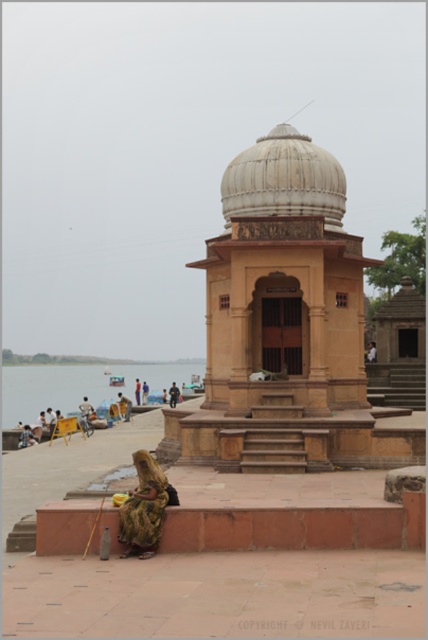
Question: Which object is farther from the camera taking this photo?

Choices:
 (A) blue water at lower left
 (B) gold textured saree at lower left

Answer: (A)

Question: Does blue water at lower left have a smaller size compared to gold textured saree at lower left?

Choices:
 (A) yes
 (B) no

Answer: (B)

Question: Does blue water at lower left have a greater width compared to gold textured saree at lower left?

Choices:
 (A) yes
 (B) no

Answer: (A)

Question: From the image, what is the correct spatial relationship of blue water at lower left in relation to gold textured saree at lower left?

Choices:
 (A) below
 (B) above

Answer: (A)

Question: Which point appears closest to the camera in this image?

Choices:
 (A) (180, 380)
 (B) (133, 492)

Answer: (B)